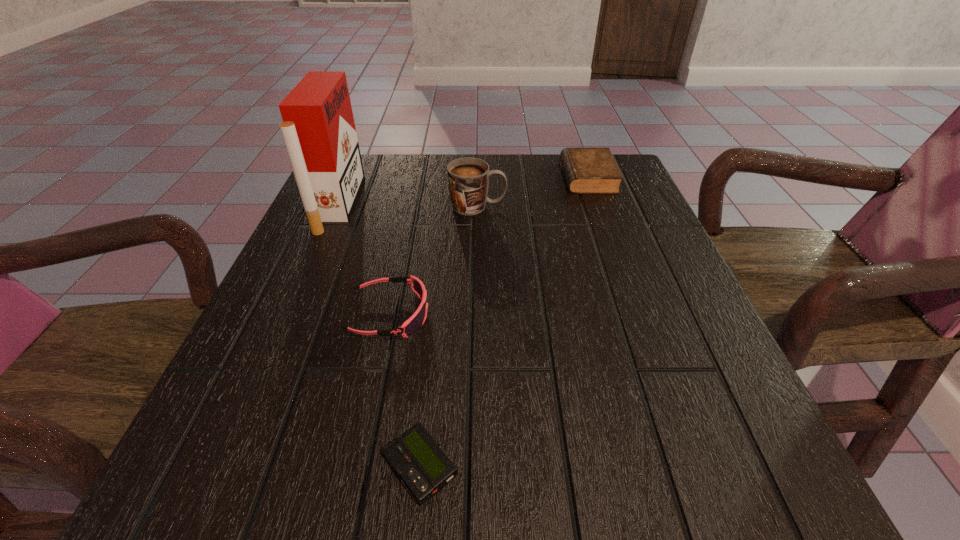
The width and height of the screenshot is (960, 540). I want to click on free space in the image that satisfies the following two spatial constraints: 1. on the front-facing side of the shortest object; 2. on the right side of the goggles, so click(358, 467).